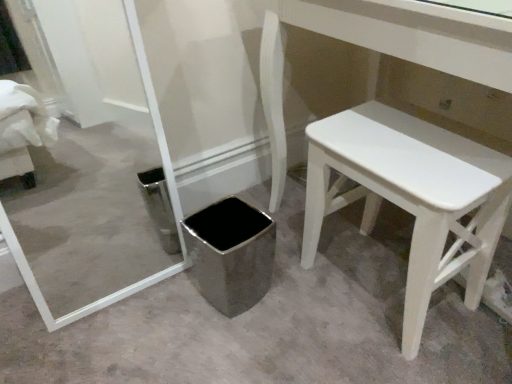
Question: Is polished stainless steel trash can at center oriented towards white painted wood stool at lower right?

Choices:
 (A) no
 (B) yes

Answer: (A)

Question: Can you confirm if polished stainless steel trash can at center is shorter than white painted wood stool at lower right?

Choices:
 (A) yes
 (B) no

Answer: (A)

Question: Can you confirm if polished stainless steel trash can at center is taller than white painted wood stool at lower right?

Choices:
 (A) no
 (B) yes

Answer: (A)

Question: Is white painted wood stool at lower right a part of polished stainless steel trash can at center?

Choices:
 (A) yes
 (B) no

Answer: (B)

Question: From the image's perspective, does polished stainless steel trash can at center appear higher than white painted wood stool at lower right?

Choices:
 (A) yes
 (B) no

Answer: (B)

Question: Considering the relative positions of polished stainless steel trash can at center and white painted wood stool at lower right in the image provided, is polished stainless steel trash can at center to the right of white painted wood stool at lower right from the viewer's perspective?

Choices:
 (A) no
 (B) yes

Answer: (A)

Question: Is white painted wood stool at lower right positioned far away from polished stainless steel trash can at center?

Choices:
 (A) no
 (B) yes

Answer: (A)

Question: Is white painted wood stool at lower right facing towards polished stainless steel trash can at center?

Choices:
 (A) yes
 (B) no

Answer: (A)

Question: Would you say white painted wood stool at lower right contains polished stainless steel trash can at center?

Choices:
 (A) no
 (B) yes

Answer: (A)

Question: From the image's perspective, is white painted wood stool at lower right located above polished stainless steel trash can at center?

Choices:
 (A) no
 (B) yes

Answer: (B)

Question: Is white painted wood stool at lower right positioned beyond the bounds of polished stainless steel trash can at center?

Choices:
 (A) yes
 (B) no

Answer: (A)

Question: Considering the relative sizes of white painted wood stool at lower right and polished stainless steel trash can at center in the image provided, is white painted wood stool at lower right wider than polished stainless steel trash can at center?

Choices:
 (A) no
 (B) yes

Answer: (B)

Question: From a real-world perspective, relative to polished stainless steel trash can at center, is white painted wood stool at lower right vertically above or below?

Choices:
 (A) above
 (B) below

Answer: (A)